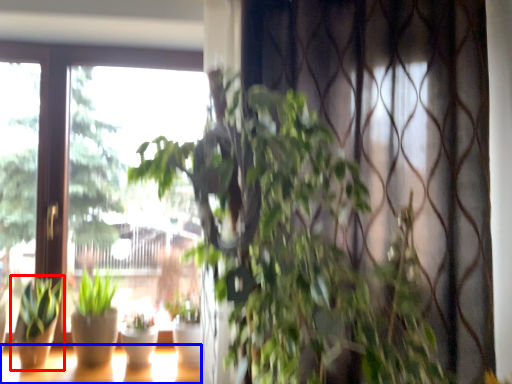
Question: Which object is closer to the camera taking this photo, houseplant (highlighted by a red box) or window (highlighted by a blue box)?

Choices:
 (A) houseplant
 (B) window

Answer: (B)